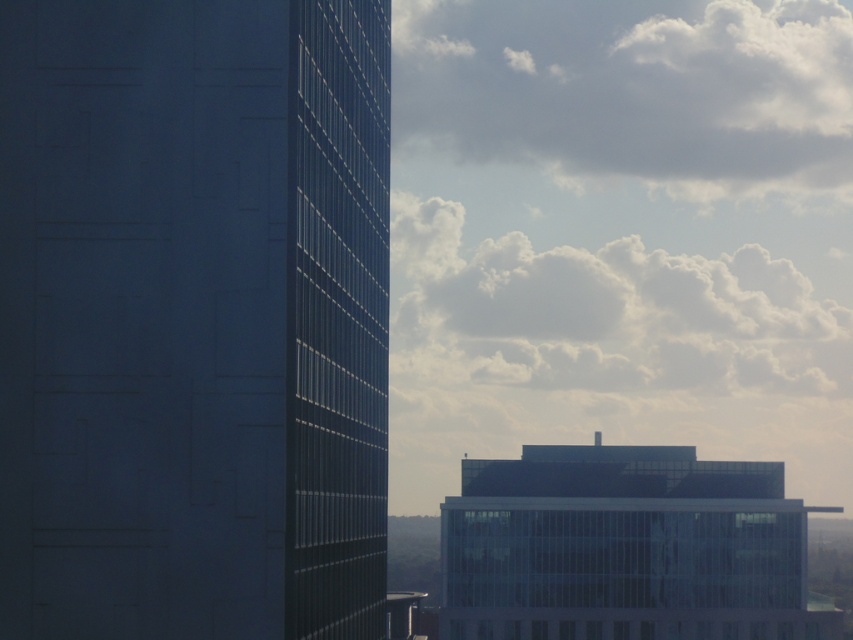
You are an architect analyzing the cityscape. You notice the dark glass building at left and the white fluffy cloud at upper right. Based on their positions in the image, which object is closer to the horizon line?

The dark glass building at left is located below the white fluffy cloud at upper right, which means it is closer to the horizon line than the cloud.

You are an architect evaluating the cityscape. You notice the dark glass building at left and the white fluffy cloud at upper right. Which object is lower in the image?

The dark glass building at left is lower in the image compared to the white fluffy cloud at upper right, as it has a lesser height.